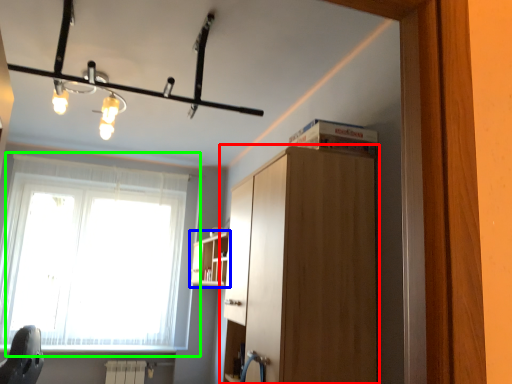
Question: Based on their relative distances, which object is farther from cabinetry (highlighted by a red box)? Choose from shelf (highlighted by a blue box) and window (highlighted by a green box).

Choices:
 (A) shelf
 (B) window

Answer: (B)